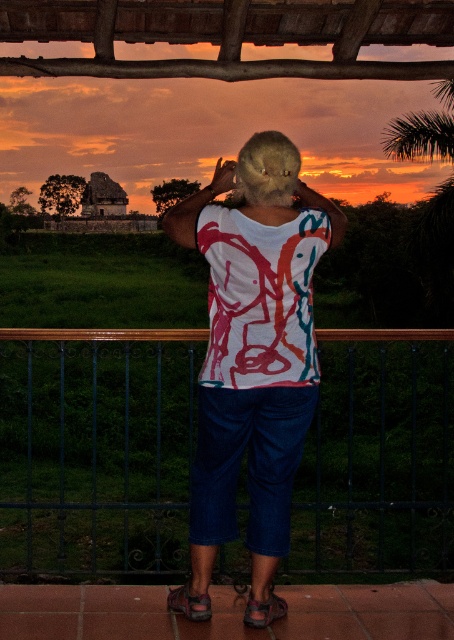
You are standing at point (x=305, y=193) and want to reach point (x=58, y=352). Given that the path between them is clear, will you have to walk towards the building or away from it?

Since point (x=58, y=352) is behind point (x=305, y=193), you will have to walk away from the building to reach it.

You are a photographer trying to capture the sunset while standing on the tiled platform. You notice the metallic blue fence at lower center and the white printed shirt at center in your frame. Which object is closer to you, the photographer?

The metallic blue fence at lower center is closer to you because the white printed shirt at center is behind it.

You are standing at the point marked as point (97, 449) in the image. What object are you currently standing on?

You are standing on the metallic blue fence at lower center.